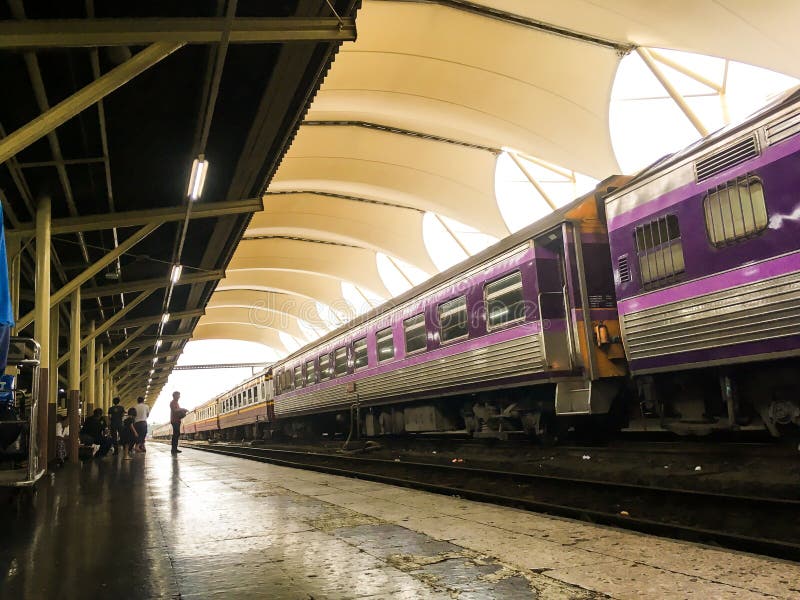
Locate an element on the screen. fluorescent lights is located at coordinates (201, 194).